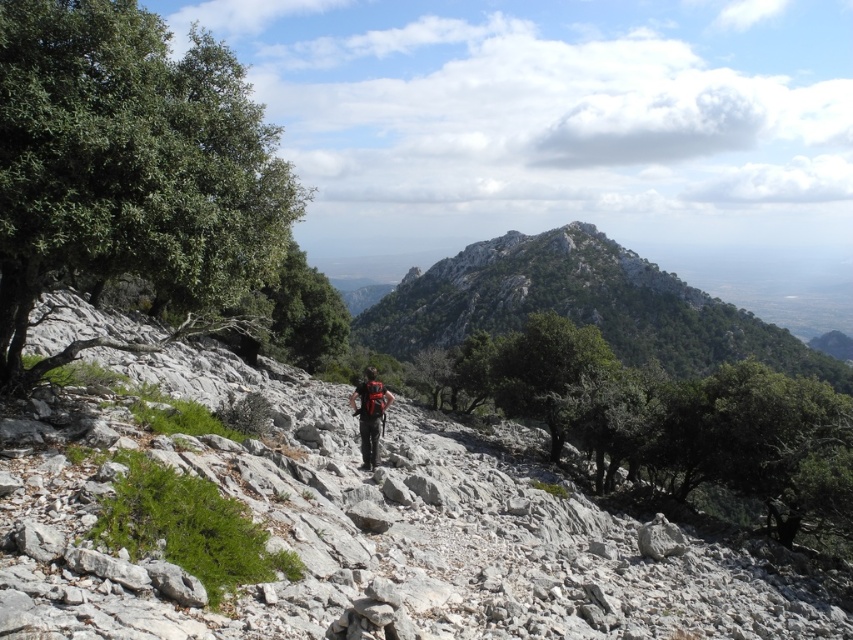
Question: Among these points, which one is nearest to the camera?

Choices:
 (A) (390, 353)
 (B) (252, 150)

Answer: (B)

Question: Estimate the real-world distances between objects in this image. Which object is farther from the green rocky mountain at center?

Choices:
 (A) green leafy tree at left
 (B) matte black backpack at center

Answer: (B)

Question: Does green rocky mountain at center appear under matte black backpack at center?

Choices:
 (A) yes
 (B) no

Answer: (B)

Question: Among these points, which one is nearest to the camera?

Choices:
 (A) (366, 376)
 (B) (709, 328)

Answer: (A)

Question: Is green leafy tree at left to the left of matte black backpack at center from the viewer's perspective?

Choices:
 (A) no
 (B) yes

Answer: (B)

Question: Can you confirm if green leafy tree at left is positioned above green rocky mountain at center?

Choices:
 (A) yes
 (B) no

Answer: (B)